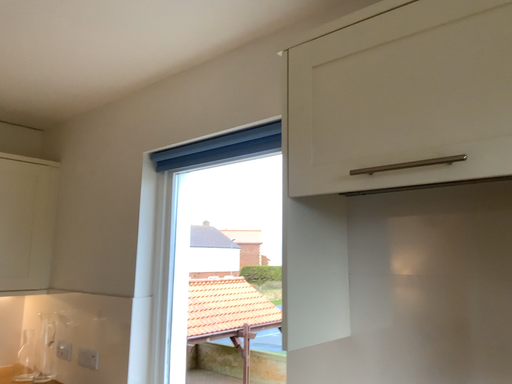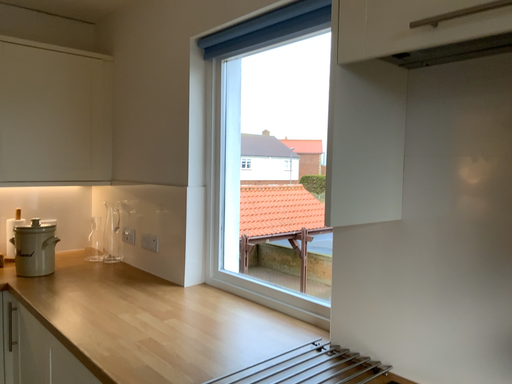
Question: How did the camera likely rotate when shooting the video?

Choices:
 (A) rotated upward
 (B) rotated downward

Answer: (B)